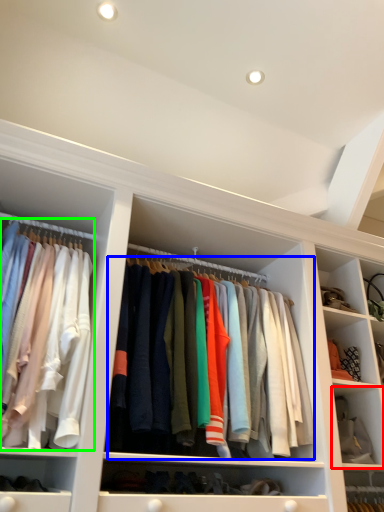
Question: Which object is positioned farthest from cabinet (highlighted by a red box)? Select from clothing (highlighted by a blue box) and clothing (highlighted by a green box).

Choices:
 (A) clothing
 (B) clothing

Answer: (B)